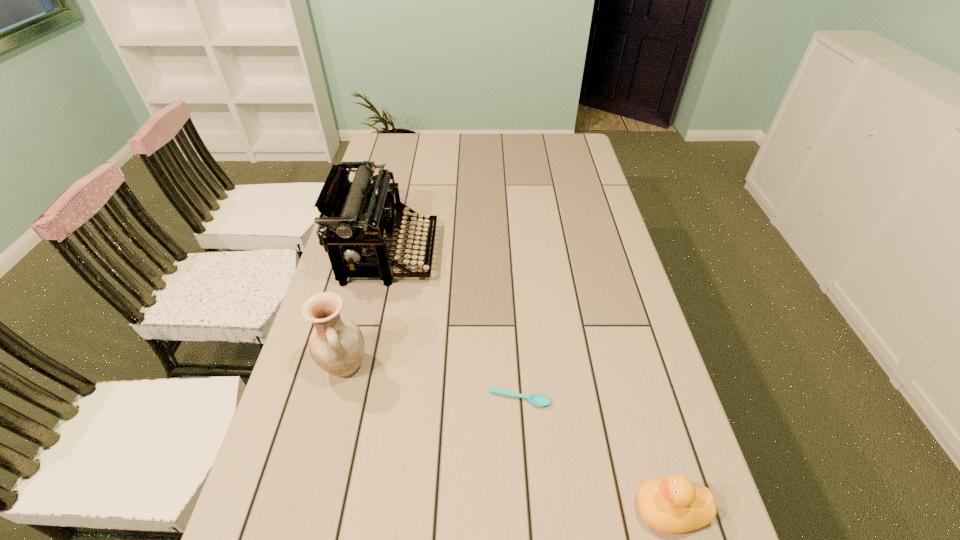
This screenshot has height=540, width=960. Find the location of `object that is the closest to the third object from left to right`. object that is the closest to the third object from left to right is located at coordinates (673, 505).

Find the location of a particular element. The image size is (960, 540). vacant region that satisfies the following two spatial constraints: 1. on the typing side of the third object from left to right; 2. on the left side of the farthest object is located at coordinates (357, 399).

The height and width of the screenshot is (540, 960). I want to click on vacant space that satisfies the following two spatial constraints: 1. on the front side of the shortest object; 2. on the left side of the third shortest object, so click(x=336, y=399).

Identify the location of vacant space that satisfies the following two spatial constraints: 1. on the typing side of the farthest object; 2. on the back side of the third object from left to right. The image size is (960, 540). (357, 399).